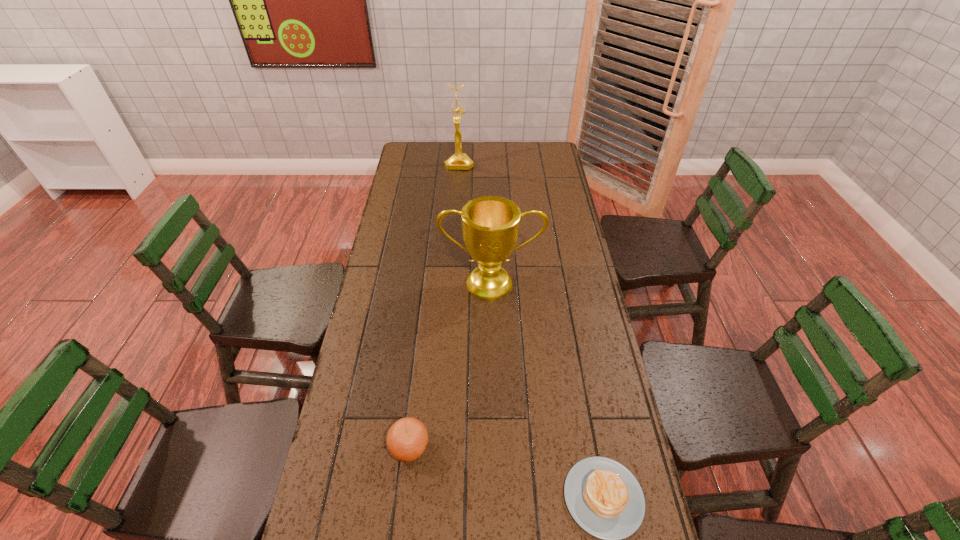
Where is `vacant area at the far edge of the desktop`? The height and width of the screenshot is (540, 960). vacant area at the far edge of the desktop is located at coordinates (519, 161).

In the image, there is a desktop. Identify the location of vacant space at the left edge. Image resolution: width=960 pixels, height=540 pixels. (412, 288).

The width and height of the screenshot is (960, 540). In the image, there is a desktop. What are the coordinates of `free region at the right edge` in the screenshot? It's located at (546, 192).

The height and width of the screenshot is (540, 960). I want to click on vacant space at the far left corner of the desktop, so click(x=419, y=165).

Where is `vacant area that lies between the clementine and the nearer award`? The width and height of the screenshot is (960, 540). vacant area that lies between the clementine and the nearer award is located at coordinates (450, 365).

You are a GUI agent. You are given a task and a screenshot of the screen. Output one action in this format:
    pyautogui.click(x=<x>, y=<y>)
    Task: Click on the vacant area between the farther award and the clementine
    The width and height of the screenshot is (960, 540).
    Given the screenshot: What is the action you would take?
    pyautogui.click(x=434, y=305)

Locate an element on the screen. This screenshot has height=540, width=960. empty space between the second shortest object and the second tallest object is located at coordinates (450, 365).

Find the location of a particular element. The width and height of the screenshot is (960, 540). empty space between the third shortest object and the third tallest object is located at coordinates (450, 365).

The width and height of the screenshot is (960, 540). In order to click on object that is the third closest to the shortest object in this screenshot , I will do `click(459, 161)`.

Identify which object is the third nearest to the nearer award. Please provide its 2D coordinates. Your answer should be formatted as a tuple, i.e. [(x, y)], where the tuple contains the x and y coordinates of a point satisfying the conditions above.

[(459, 161)]